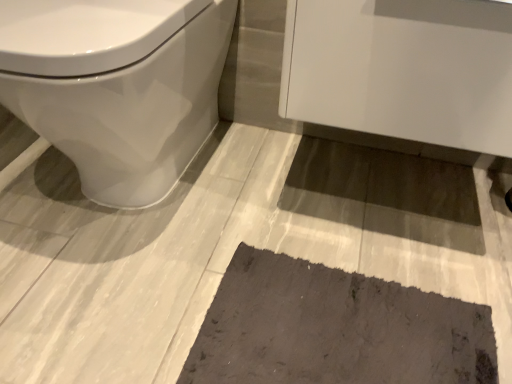
I want to click on unoccupied region to the right of white glossy toilet at left, so click(297, 185).